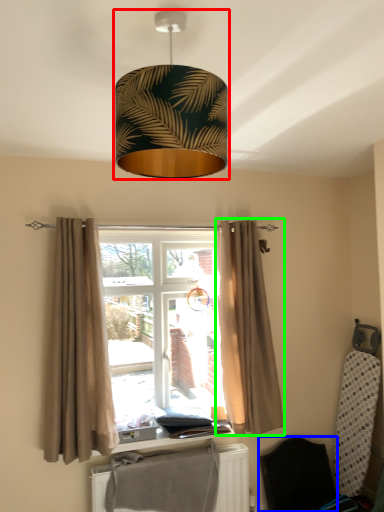
Question: Which object is positioned closest to lamp (highlighted by a red box)? Select from folding chair (highlighted by a blue box) and curtain (highlighted by a green box).

Choices:
 (A) folding chair
 (B) curtain

Answer: (B)